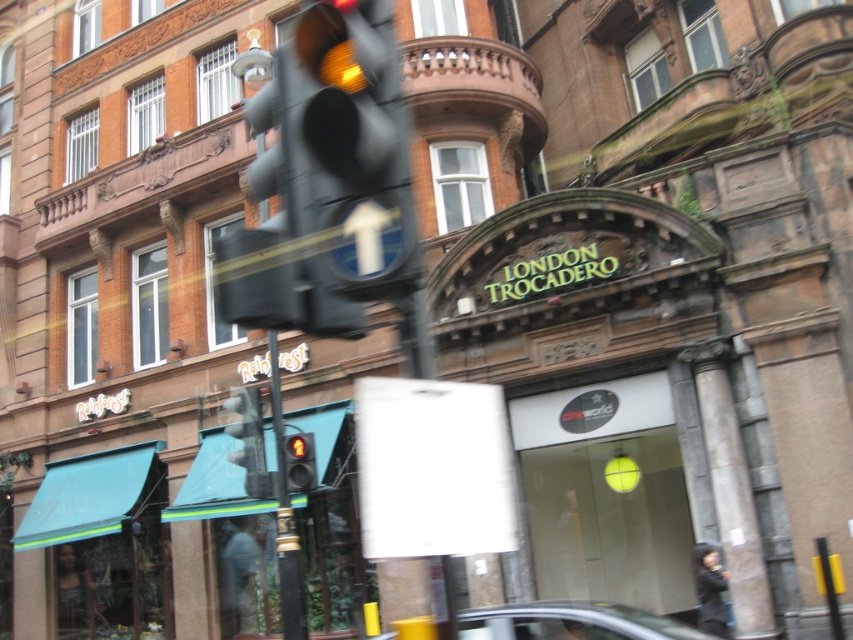
Is point (297, 624) less distant than point (271, 497)?

Yes, it is in front of point (271, 497).

Between metallic pole at center and metallic traffic light at center, which one appears on the right side from the viewer's perspective?

metallic pole at center is more to the right.

At what (x,y) coordinates should I click in order to perform the action: click on metallic pole at center. Please return your answer as a coordinate pair (x, y). The width and height of the screenshot is (853, 640). Looking at the image, I should click on click(285, 516).

Between point (555, 620) and point (302, 605), which one is positioned in front?

Positioned in front is point (555, 620).

How much distance is there between metallic silver car at lower center and metallic pole at center?

metallic silver car at lower center and metallic pole at center are 9.15 meters apart from each other.

Who is more distant from viewer, (465, 632) or (296, 560)?

The point (296, 560) is more distant.

Identify the location of metallic silver car at lower center. (572, 621).

How much distance is there between metallic silver car at lower center and yellow glass traffic light at center?

A distance of 9.18 meters exists between metallic silver car at lower center and yellow glass traffic light at center.

Who is more forward, (x=671, y=628) or (x=299, y=486)?

Point (x=671, y=628) is in front.

The height and width of the screenshot is (640, 853). Find the location of `metallic silver car at lower center`. metallic silver car at lower center is located at coordinates (572, 621).